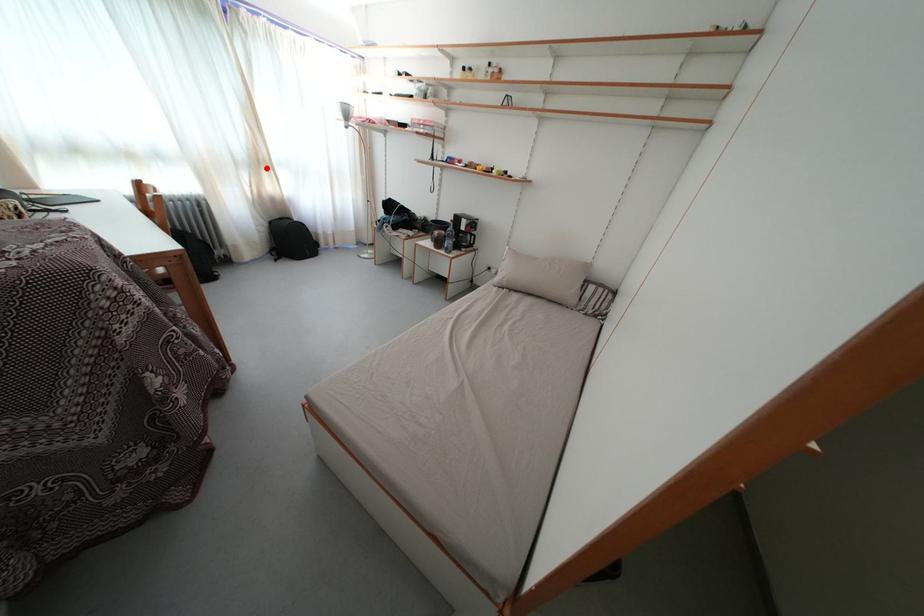
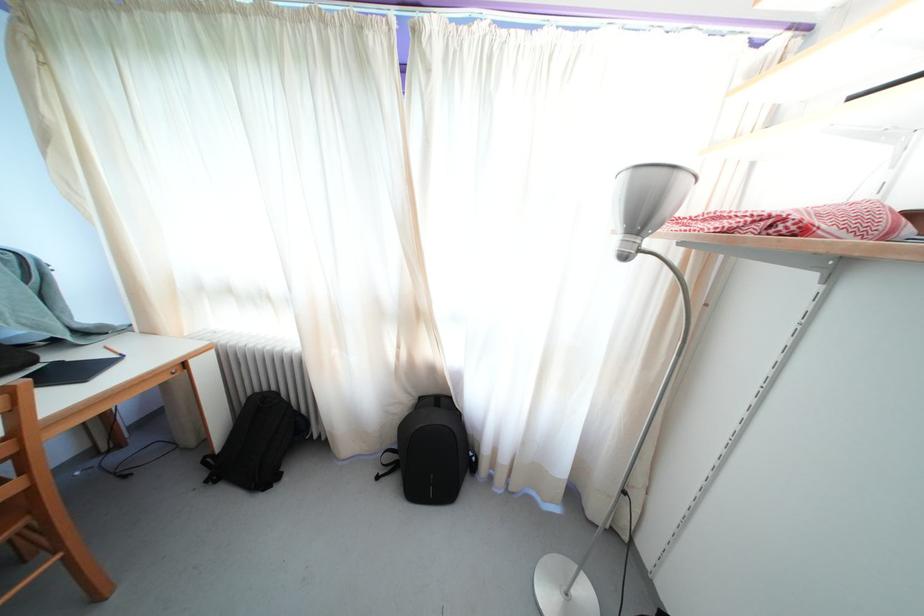
Question: I am providing you with two images of the same scene from different viewpoints. A red point is shown in image1. For the corresponding object point in image2, is it positioned nearer or farther from the camera?

Choices:
 (A) Nearer
 (B) Farther

Answer: (B)